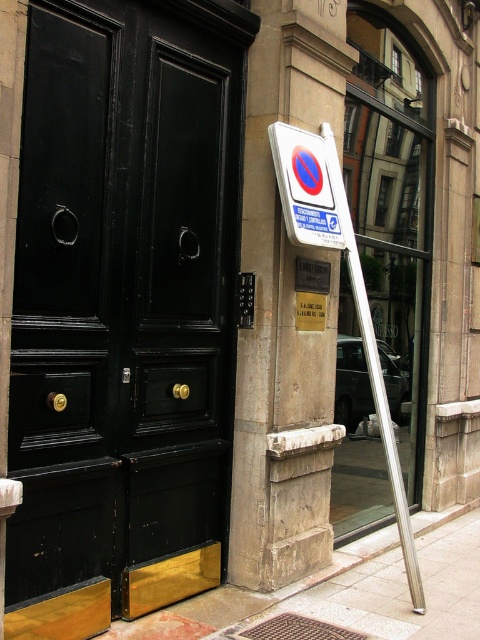
You are standing in front of the building and need to locate the entrance. The stone pillar at center and the white plastic sign at center are in your line of sight. According to their positions, which object is closer to the left side of the entrance?

The stone pillar at center is to the left of the white plastic sign at center, so the stone pillar at center is closer to the left side of the entrance.

Looking at this image, you are a delivery person trying to park your van in front of the stone pillar at center and the white plastic sign at center. The van requires a minimum of 18 inches of space to park. Can you park your van there?

The stone pillar at center is 17.15 inches from the white plastic sign at center, which is less than the required 18 inches. Therefore, you cannot park your van there.

You are standing on the smooth concrete sidewalk at lower center and want to reach the stone pillar at center. Which direction should you move to get there?

The stone pillar at center is positioned over the smooth concrete sidewalk at lower center, so you should move forward to reach it.